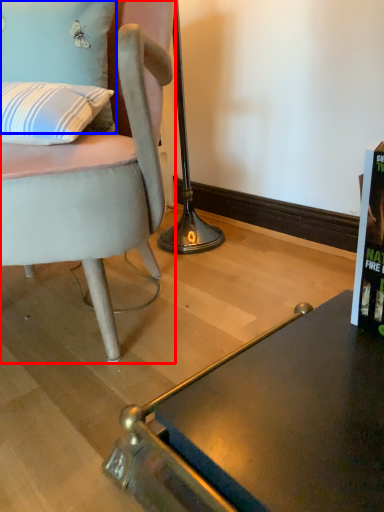
Question: Which object is closer to the camera taking this photo, chair (highlighted by a red box) or pillow (highlighted by a blue box)?

Choices:
 (A) chair
 (B) pillow

Answer: (A)